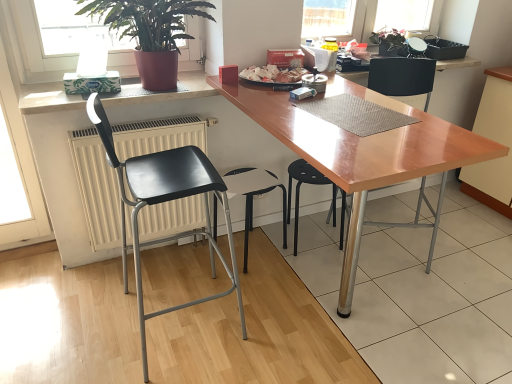
Image resolution: width=512 pixels, height=384 pixels. What are the coordinates of `green matte plant at upper center, which appears as the 1th houseplant when viewed from the right` in the screenshot? It's located at [389, 41].

The width and height of the screenshot is (512, 384). What do you see at coordinates (493, 140) in the screenshot? I see `light wood cabinet at lower right` at bounding box center [493, 140].

What do you see at coordinates (164, 202) in the screenshot? This screenshot has height=384, width=512. I see `black matte chair at left, the fourth chair viewed from the right` at bounding box center [164, 202].

How much space does matte black chair at center, which is counted as the 1th chair, starting from the right, occupy horizontally?

matte black chair at center, which is counted as the 1th chair, starting from the right, is 46.71 centimeters in width.

What do you see at coordinates (161, 92) in the screenshot? This screenshot has width=512, height=384. I see `white matte counter top at upper left` at bounding box center [161, 92].

At what (x,y) coordinates should I click in order to perform the action: click on white matte radiator at left. Please return your answer as a coordinate pair (x, y). The height and width of the screenshot is (384, 512). Looking at the image, I should click on (96, 189).

This screenshot has height=384, width=512. I want to click on green matte plant at upper center, which appears as the 1th houseplant when viewed from the right, so click(389, 41).

Based on the photo, is green glossy plant at upper left, which appears as the 1th houseplant when viewed from the left, beside black plastic stool at center, positioned as the 2th chair in left-to-right order?

There is a gap between green glossy plant at upper left, which appears as the 1th houseplant when viewed from the left, and black plastic stool at center, positioned as the 2th chair in left-to-right order.

From a real-world perspective, who is located higher, green glossy plant at upper left, which is counted as the second houseplant, starting from the back, or black plastic stool at center, positioned as the 2th chair in left-to-right order?

green glossy plant at upper left, which is counted as the second houseplant, starting from the back, is physically above.

Is green glossy plant at upper left, which is counted as the second houseplant, starting from the back, further to the viewer compared to black plastic stool at center, positioned as the 2th chair in left-to-right order?

No, green glossy plant at upper left, which is counted as the second houseplant, starting from the back, is closer to the camera.

How different are the orientations of green glossy plant at upper left, which is counted as the second houseplant, starting from the back, and black plastic stool at center, positioned as the 2th chair in left-to-right order, in degrees?

4.35e-05 degrees separate the facing orientations of green glossy plant at upper left, which is counted as the second houseplant, starting from the back, and black plastic stool at center, positioned as the 2th chair in left-to-right order.

Is point (335, 210) positioned before point (177, 196)?

That is False.

This screenshot has height=384, width=512. Identify the location of the 2nd chair to the left of the black plastic stool at center, the 3th chair in the left-to-right sequence, starting your count from the anchor. (164, 202).

Looking at this image, from a real-world perspective, is black plastic stool at center, placed as the second chair when sorted from right to left, positioned under black matte chair at left, acting as the 1th chair starting from the left, based on gravity?

Yes.

Is black plastic stool at center, the 3th chair in the left-to-right sequence, oriented towards black matte chair at left, the fourth chair viewed from the right?

No, black plastic stool at center, the 3th chair in the left-to-right sequence, does not turn towards black matte chair at left, the fourth chair viewed from the right.

Is matte black chair at center, arranged as the fourth chair when viewed from the left, turned away from white glossy plate at center?

matte black chair at center, arranged as the fourth chair when viewed from the left, does not have its back to white glossy plate at center.

Between matte black chair at center, arranged as the fourth chair when viewed from the left, and white glossy plate at center, which one has larger width?

matte black chair at center, arranged as the fourth chair when viewed from the left.

Starting from the white glossy plate at center, which chair is the 1st one in front? Please provide its 2D coordinates.

[(402, 77)]

Does matte black chair at center, arranged as the fourth chair when viewed from the left, have a larger size compared to white glossy plate at center?

Yes.

Is wooden table at center further to the viewer compared to black plastic stool at center, positioned as the third chair in right-to-left order?

That is False.

Would you say black plastic stool at center, positioned as the third chair in right-to-left order, is part of wooden table at center's contents?

Yes, black plastic stool at center, positioned as the third chair in right-to-left order, can be found within wooden table at center.

Is the surface of wooden table at center in direct contact with black plastic stool at center, positioned as the 2th chair in left-to-right order?

They are not placed beside each other.

Could white glossy plate at center be considered to be inside light wood cabinet at lower right?

Actually, white glossy plate at center is outside light wood cabinet at lower right.

Between light wood cabinet at lower right and white glossy plate at center, which one has smaller size?

white glossy plate at center.

Is light wood cabinet at lower right wider or thinner than white glossy plate at center?

light wood cabinet at lower right is wider than white glossy plate at center.

Is point (509, 125) positioned before point (286, 72)?

No.

Considering the points (485, 73) and (387, 35), which point is in front, point (485, 73) or point (387, 35)?

The point (387, 35) is in front.

Considering the relative sizes of light wood cabinet at lower right and green matte plant at upper center, which is the 2th houseplant from left to right, in the image provided, is light wood cabinet at lower right smaller than green matte plant at upper center, which is the 2th houseplant from left to right,?

Incorrect, light wood cabinet at lower right is not smaller in size than green matte plant at upper center, which is the 2th houseplant from left to right.

Which of these two, light wood cabinet at lower right or green matte plant at upper center, which ranks as the 2th houseplant in front-to-back order, stands taller?

With more height is light wood cabinet at lower right.

From the image's perspective, is white matte counter top at upper left located beneath black plastic stool at center, positioned as the third chair in right-to-left order?

Actually, white matte counter top at upper left appears above black plastic stool at center, positioned as the third chair in right-to-left order, in the image.

Which object is closer to the camera, white matte counter top at upper left or black plastic stool at center, positioned as the third chair in right-to-left order?

white matte counter top at upper left is more forward.

Is white matte counter top at upper left at the right side of black plastic stool at center, positioned as the 2th chair in left-to-right order?

No, white matte counter top at upper left is not to the right of black plastic stool at center, positioned as the 2th chair in left-to-right order.

Where is `the 3rd chair below the green glossy plant at upper left, the second houseplant in the right-to-left sequence (from the image's perspective)`? Image resolution: width=512 pixels, height=384 pixels. the 3rd chair below the green glossy plant at upper left, the second houseplant in the right-to-left sequence (from the image's perspective) is located at coordinates (253, 197).

I want to click on the 1st chair directly beneath the black matte chair at left, acting as the 1th chair starting from the left (from a real-world perspective), so click(x=306, y=183).

Which object lies further to the anchor point green glossy plant at upper left, the second houseplant in the right-to-left sequence, white matte radiator at left or white glossy plate at center?

white glossy plate at center.

From the image, which object appears to be nearer to white glossy plate at center, light wood cabinet at lower right or matte black chair at center, arranged as the fourth chair when viewed from the left?

matte black chair at center, arranged as the fourth chair when viewed from the left, is positioned closer to the anchor white glossy plate at center.

From the image, which object appears to be nearer to white matte counter top at upper left, wooden table at center or black plastic stool at center, the 3th chair in the left-to-right sequence?

Based on the image, wooden table at center appears to be nearer to white matte counter top at upper left.

Based on the photo, estimate the real-world distances between objects in this image. Which object is closer to white matte counter top at upper left, white glossy plate at center or wooden table at center?

white glossy plate at center is positioned closer to the anchor white matte counter top at upper left.

From the image, which object appears to be nearer to black matte chair at left, the fourth chair viewed from the right, white matte counter top at upper left or black plastic stool at center, positioned as the 2th chair in left-to-right order?

Among the two, black plastic stool at center, positioned as the 2th chair in left-to-right order, is located nearer to black matte chair at left, the fourth chair viewed from the right.

When comparing their distances from green glossy plant at upper left, the second houseplant in the right-to-left sequence, does green matte plant at upper center, which appears as the 1th houseplant when viewed from the right, or matte black chair at center, arranged as the fourth chair when viewed from the left, seem further?

green matte plant at upper center, which appears as the 1th houseplant when viewed from the right, lies further to green glossy plant at upper left, the second houseplant in the right-to-left sequence, than the other object.

Looking at the image, which one is located closer to white matte radiator at left, white matte counter top at upper left or green matte plant at upper center, which is the 2th houseplant from left to right?

The object closer to white matte radiator at left is white matte counter top at upper left.

Estimate the real-world distances between objects in this image. Which object is closer to white matte counter top at upper left, green glossy plant at upper left, the second houseplant in the right-to-left sequence, or black matte chair at left, acting as the 1th chair starting from the left?

Result: Among the two, green glossy plant at upper left, the second houseplant in the right-to-left sequence, is located nearer to white matte counter top at upper left.

I want to click on food between green glossy plant at upper left, arranged as the 1th houseplant when viewed from the front, and black matte chair at left, the fourth chair viewed from the right, in the vertical direction, so click(x=273, y=74).

Find the location of a particular element. This screenshot has height=384, width=512. radiator between black matte chair at left, acting as the 1th chair starting from the left, and black plastic stool at center, placed as the second chair when sorted from right to left, along the z-axis is located at coordinates (96, 189).

The height and width of the screenshot is (384, 512). Find the location of `radiator positioned between black matte chair at left, the fourth chair viewed from the right, and black plastic stool at center, positioned as the third chair in right-to-left order, from near to far`. radiator positioned between black matte chair at left, the fourth chair viewed from the right, and black plastic stool at center, positioned as the third chair in right-to-left order, from near to far is located at coordinates (96, 189).

Identify the location of houseplant between white glossy plate at center and light wood cabinet at lower right. (389, 41).